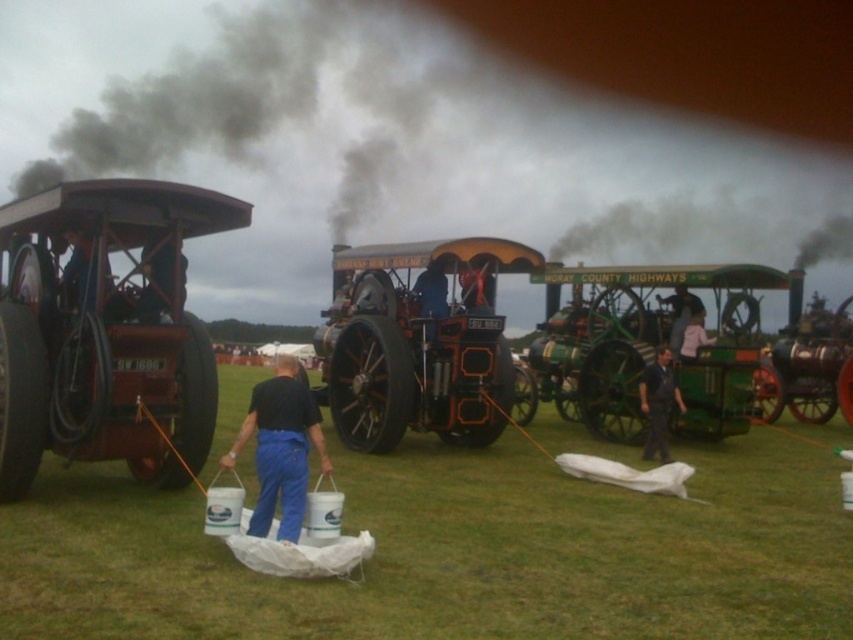
Question: From the image, what is the correct spatial relationship of green grass at lower center in relation to blue fabric at left?

Choices:
 (A) left
 (B) right

Answer: (B)

Question: Does dark blue fabric at center have a lesser width compared to pink fabric at center?

Choices:
 (A) no
 (B) yes

Answer: (B)

Question: Which point is farther from the camera taking this photo?

Choices:
 (A) (254, 397)
 (B) (666, 416)
 (C) (422, 80)

Answer: (C)

Question: Which of these objects is positioned farthest from the metallic blue overalls at center?

Choices:
 (A) blue fabric at left
 (B) green grass at lower center

Answer: (B)

Question: Which of the following is the closest to the observer?

Choices:
 (A) blue fabric at left
 (B) pink fabric at center
 (C) blue fabric pants at center

Answer: (C)

Question: From the image, what is the correct spatial relationship of polished brass steam engine at center in relation to dark blue fabric at center?

Choices:
 (A) above
 (B) below

Answer: (A)